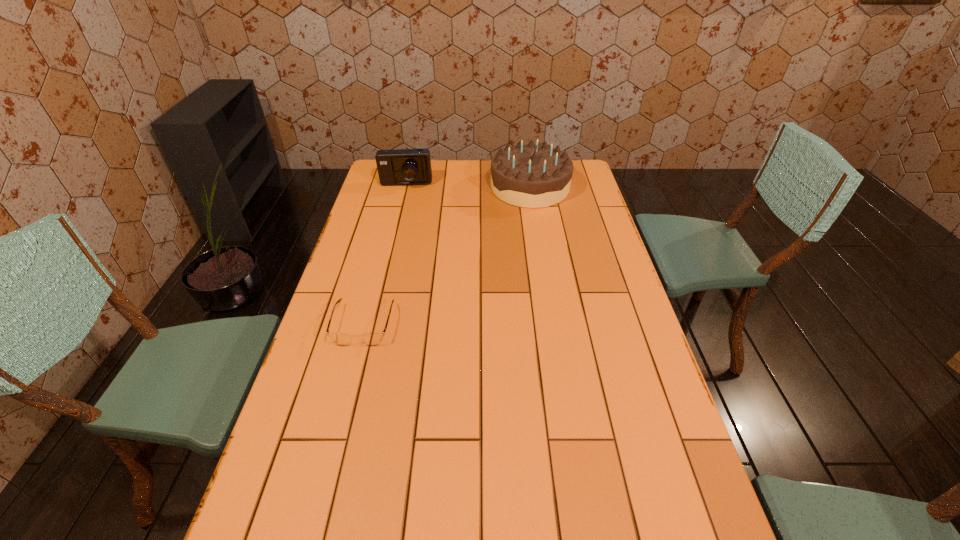
Choose which object is the nearest neighbor to the camera. Please provide its 2D coordinates. Your answer should be formatted as a tuple, i.e. [(x, y)], where the tuple contains the x and y coordinates of a point satisfying the conditions above.

[(526, 175)]

Locate an element on the screen. The image size is (960, 540). vacant area in the image that satisfies the following two spatial constraints: 1. on the front-facing side of the birthday cake; 2. on the front-facing side of the nearest object is located at coordinates (552, 325).

Where is `vacant space that satisfies the following two spatial constraints: 1. on the front-facing side of the birthday cake; 2. on the front-facing side of the spectacles`? This screenshot has width=960, height=540. vacant space that satisfies the following two spatial constraints: 1. on the front-facing side of the birthday cake; 2. on the front-facing side of the spectacles is located at coordinates (552, 325).